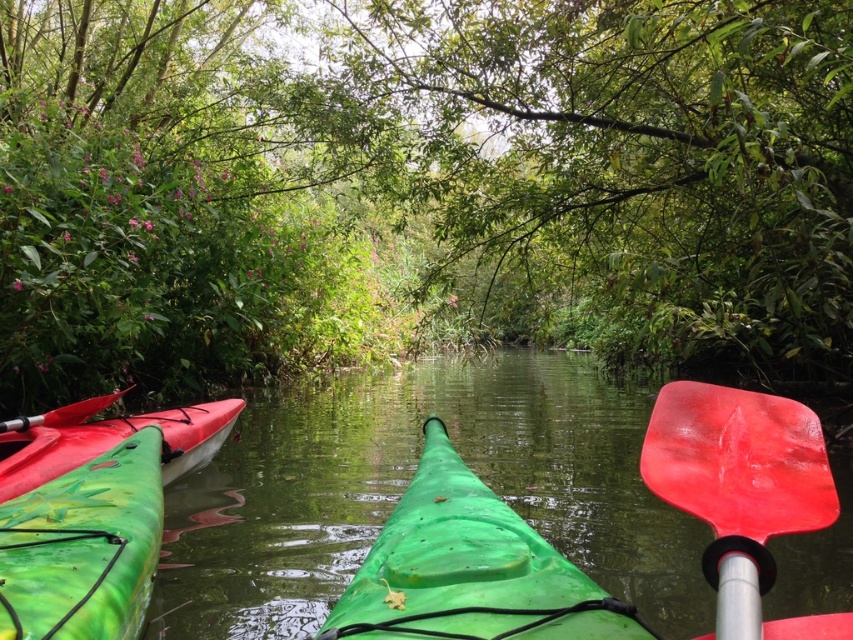
Which is behind, point (248, 458) or point (9, 433)?

Point (248, 458)

Can you confirm if green plastic kayak at center is shorter than green matte kayak at left?

Incorrect, green plastic kayak at center's height does not fall short of green matte kayak at left's.

Between point (171, 554) and point (83, 442), which one is positioned in front?

Point (171, 554) is more forward.

The height and width of the screenshot is (640, 853). In order to click on green plastic kayak at center in this screenshot , I will do `click(405, 486)`.

Between green matte tree at center and green matte kayak at left, which one is positioned lower?

Positioned lower is green matte kayak at left.

Is green matte tree at center to the left of green matte kayak at left from the viewer's perspective?

In fact, green matte tree at center is to the right of green matte kayak at left.

Identify the location of green matte tree at center. (419, 186).

Is red matte paddle at center closer to the viewer compared to matte red paddle at left?

Yes.

Does point (666, 387) come farther from viewer compared to point (16, 420)?

No, (666, 387) is in front of (16, 420).

At what (x,y) coordinates should I click in order to perform the action: click on red matte paddle at center. Please return your answer as a coordinate pair (x, y). This screenshot has height=640, width=853. Looking at the image, I should click on (743, 492).